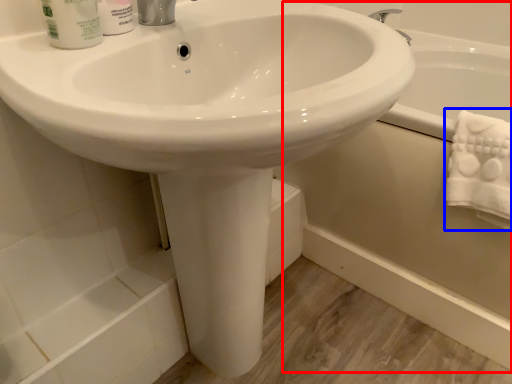
Question: Which object appears closest to the camera in this image, bath (highlighted by a red box) or bath towel (highlighted by a blue box)?

Choices:
 (A) bath
 (B) bath towel

Answer: (B)